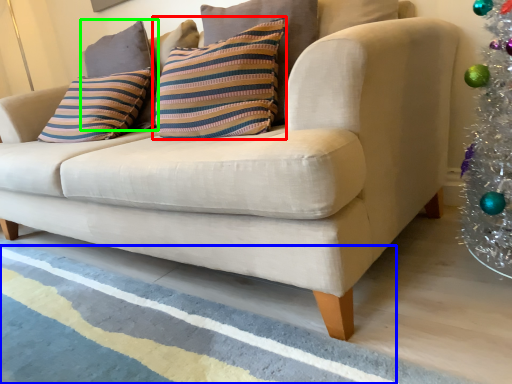
Question: Which is farther away from pillow (highlighted by a red box)? stripe (highlighted by a blue box) or pillow (highlighted by a green box)?

Choices:
 (A) stripe
 (B) pillow

Answer: (A)